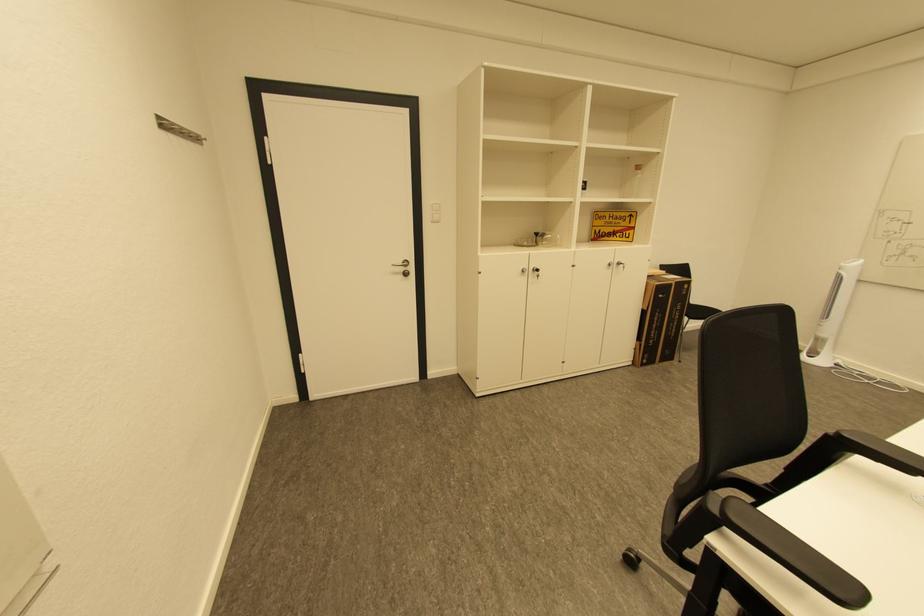
Find where to hang the metal coat hook. Please return your answer as a coordinate pair (x, y).

(178, 130)